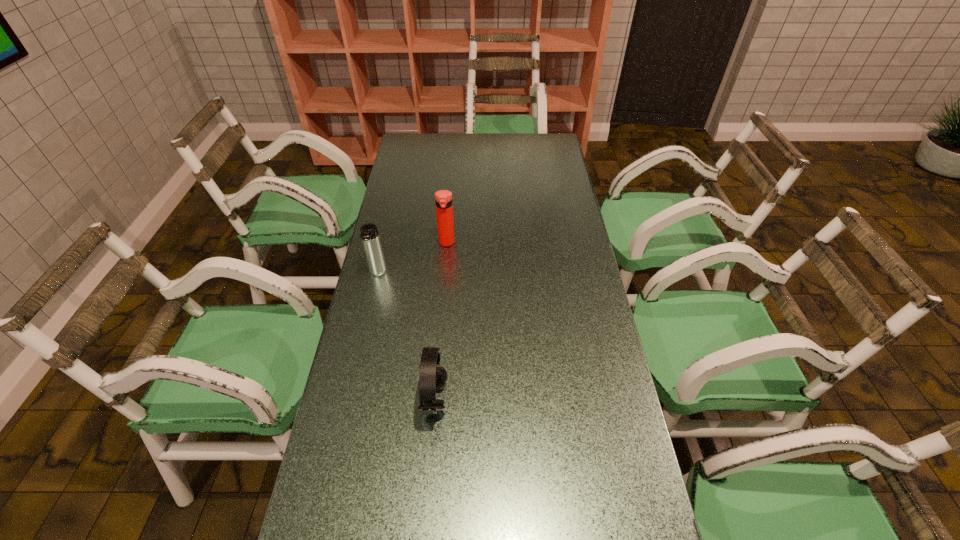
In order to click on blank area at the left edge in this screenshot , I will do click(x=360, y=348).

In the image, there is a desktop. In order to click on free space at the far right corner in this screenshot , I will do `click(544, 133)`.

The height and width of the screenshot is (540, 960). Identify the location of free area in between the nearest object and the right thermos bottle. (441, 321).

The image size is (960, 540). I want to click on vacant space that's between the leftmost object and the nearest object, so [x=406, y=337].

Find the location of `free area in between the leftmost object and the nearest object`. free area in between the leftmost object and the nearest object is located at coordinates (406, 337).

Identify the location of free point between the leftmost object and the nearest object. The height and width of the screenshot is (540, 960). (406, 337).

This screenshot has height=540, width=960. What are the coordinates of `vacant space that's between the earphone and the left thermos bottle` in the screenshot? It's located at (406, 337).

Where is `empty space that is in between the left thermos bottle and the nearest object`? empty space that is in between the left thermos bottle and the nearest object is located at coordinates (406, 337).

Where is `vacant area that lies between the farthest object and the second nearest object`? The image size is (960, 540). vacant area that lies between the farthest object and the second nearest object is located at coordinates (412, 258).

Find the location of a particular element. This screenshot has width=960, height=540. blank region between the right thermos bottle and the nearest object is located at coordinates (441, 321).